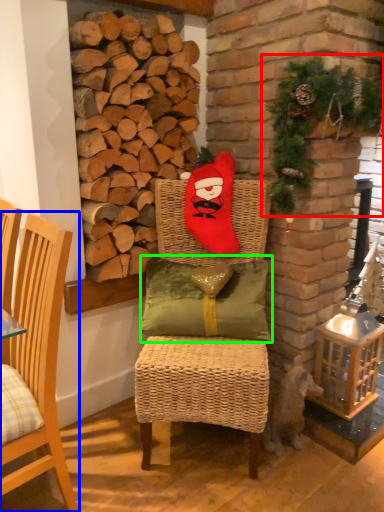
Question: Which object is the closest to the christmas decoration (highlighted by a red box)? Choose among these: chair (highlighted by a blue box) or pillow (highlighted by a green box).

Choices:
 (A) chair
 (B) pillow

Answer: (B)